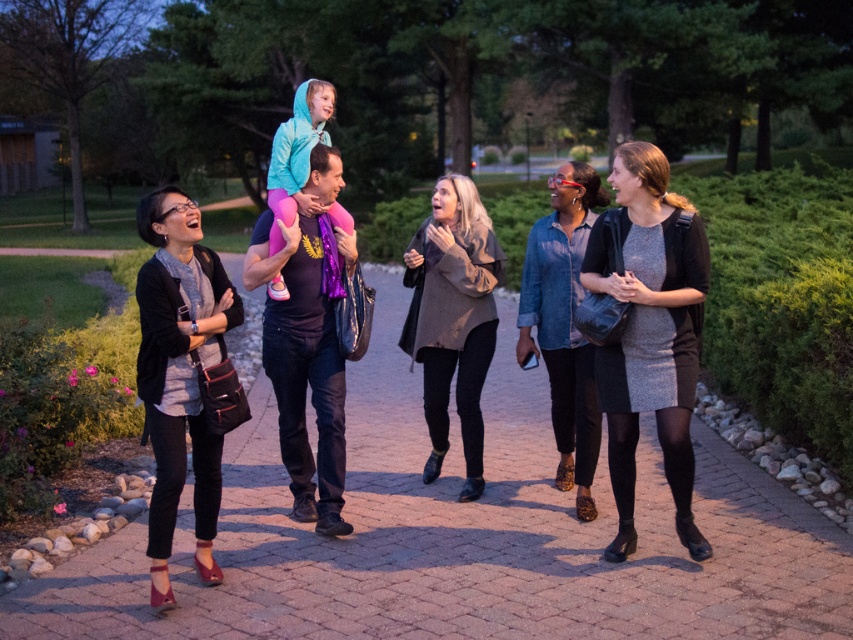
Question: Considering the relative positions of brick pavement at center and matte blue jacket at center in the image provided, where is brick pavement at center located with respect to matte blue jacket at center?

Choices:
 (A) left
 (B) right

Answer: (B)

Question: Which is farther from the matte black jacket at center?

Choices:
 (A) gray knit dress at center
 (B) brick pavement at center
 (C) dark gray textured coat at center

Answer: (B)

Question: Which of the following is the closest to the observer?

Choices:
 (A) (550, 339)
 (B) (262, 250)

Answer: (B)

Question: Which object appears closest to the camera in this image?

Choices:
 (A) matte black bag at left
 (B) dark gray textured coat at center
 (C) matte blue jacket at center

Answer: (A)

Question: Can you confirm if matte black jacket at center is wider than denim shirt at center?

Choices:
 (A) no
 (B) yes

Answer: (B)

Question: Can you confirm if brick pavement at center is positioned below denim shirt at center?

Choices:
 (A) yes
 (B) no

Answer: (A)